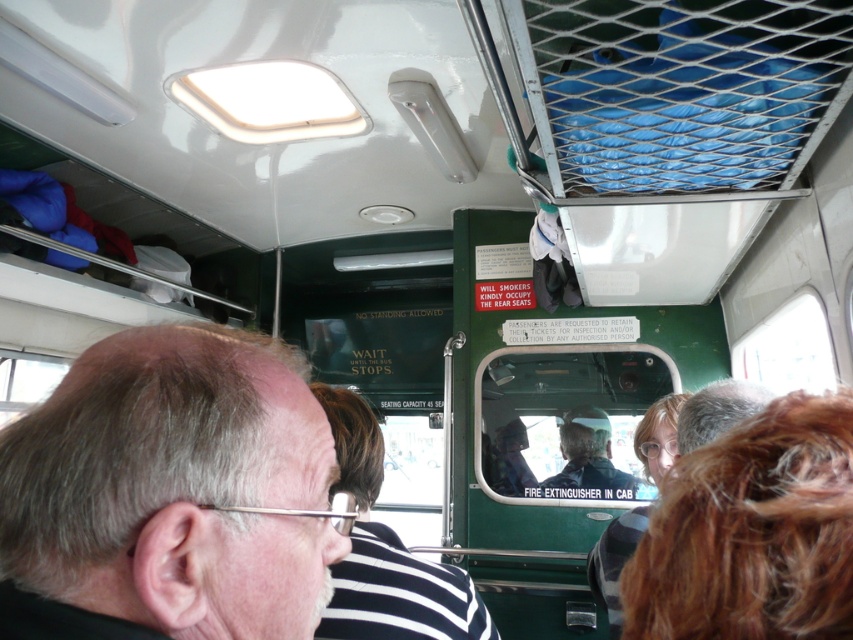
Question: Does brown curly hair at lower right appear over striped fabric shirt at center?

Choices:
 (A) no
 (B) yes

Answer: (B)

Question: Estimate the real-world distances between objects in this image. Which object is farther from the gray hair at upper left?

Choices:
 (A) smooth skin man at center
 (B) striped fabric shirt at center
 (C) brown curly hair at lower right

Answer: (A)

Question: Among these objects, which one is nearest to the camera?

Choices:
 (A) gray hair at upper left
 (B) smooth skin man at center
 (C) striped fabric shirt at center
 (D) brown curly hair at lower right

Answer: (D)

Question: Can you confirm if gray hair at upper left is smaller than brown curly hair at lower right?

Choices:
 (A) yes
 (B) no

Answer: (B)

Question: Can you confirm if brown curly hair at lower right is positioned to the left of smooth skin man at center?

Choices:
 (A) no
 (B) yes

Answer: (B)

Question: Among these objects, which one is farthest from the camera?

Choices:
 (A) gray hair at upper left
 (B) striped fabric shirt at center

Answer: (B)